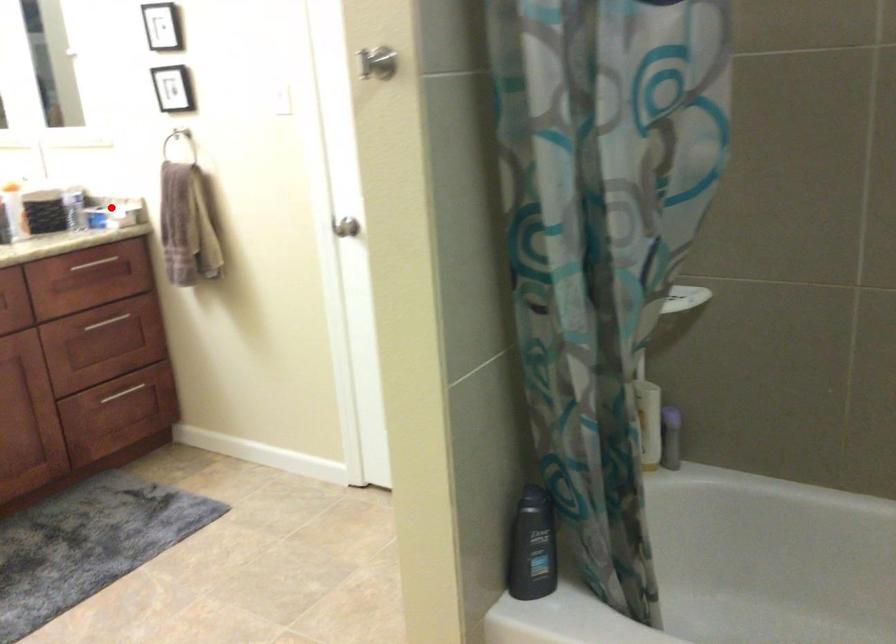
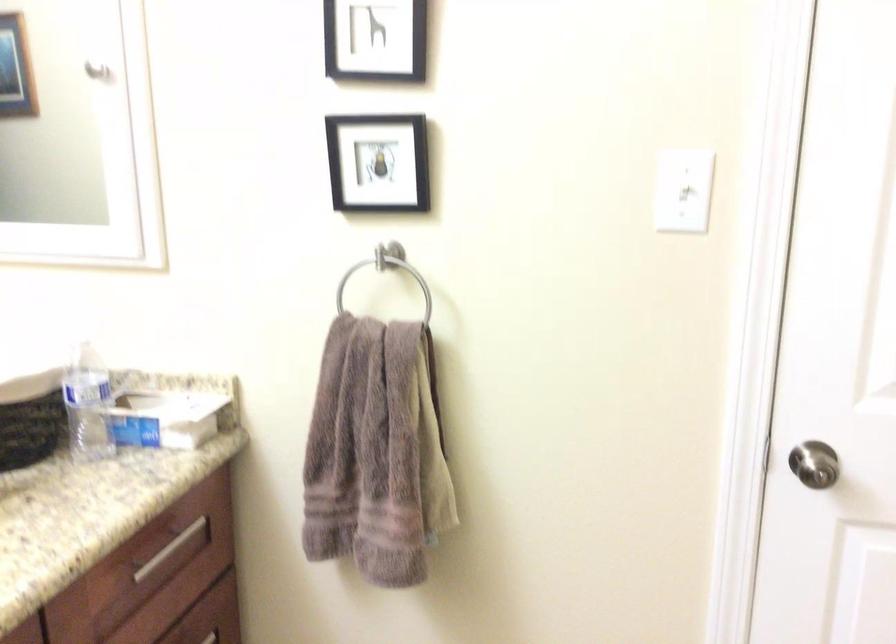
In the second image, find the point that corresponds to the highlighted location in the first image.

(165, 418)